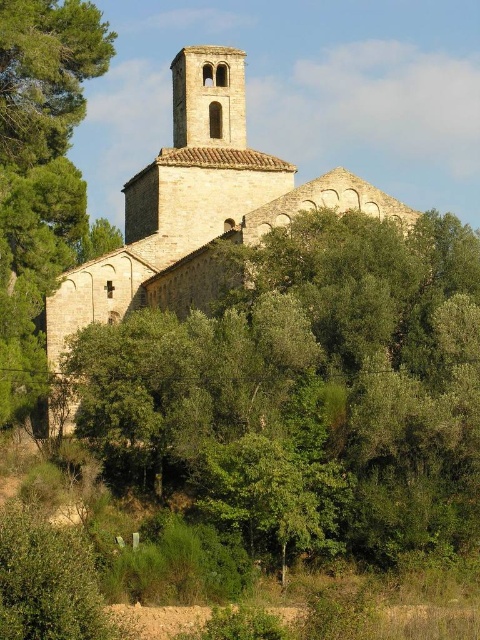
Can you confirm if stone church at center is positioned to the left of green leafy tree at left?

In fact, stone church at center is to the right of green leafy tree at left.

Between point (245, 147) and point (15, 342), which one is positioned in front?

Point (15, 342) is in front.

Between point (100, 282) and point (54, 74), which one is positioned behind?

Point (100, 282)

I want to click on stone church at center, so click(197, 205).

Is green leafy tree at center behind green leafy tree at left?

No, it is not.

What do you see at coordinates (308, 388) in the screenshot?
I see `green leafy tree at center` at bounding box center [308, 388].

The image size is (480, 640). In order to click on green leafy tree at center in this screenshot , I will do `click(308, 388)`.

Does green leafy tree at center have a lesser height compared to stone church at center?

Correct, green leafy tree at center is not as tall as stone church at center.

You are a GUI agent. You are given a task and a screenshot of the screen. Output one action in this format:
    pyautogui.click(x=<x>, y=<y>)
    Task: Click on the green leafy tree at center
    The width and height of the screenshot is (480, 640).
    Given the screenshot: What is the action you would take?
    pyautogui.click(x=308, y=388)